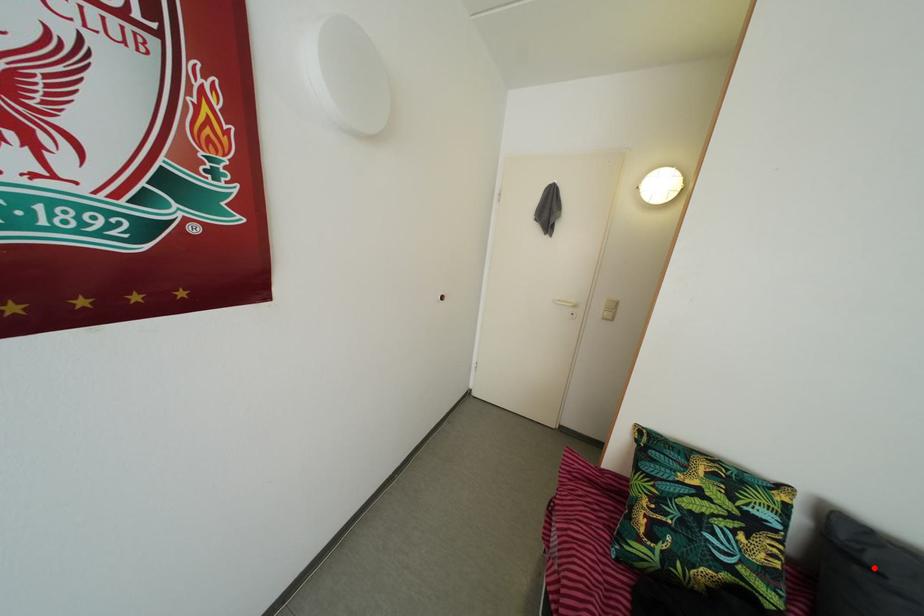
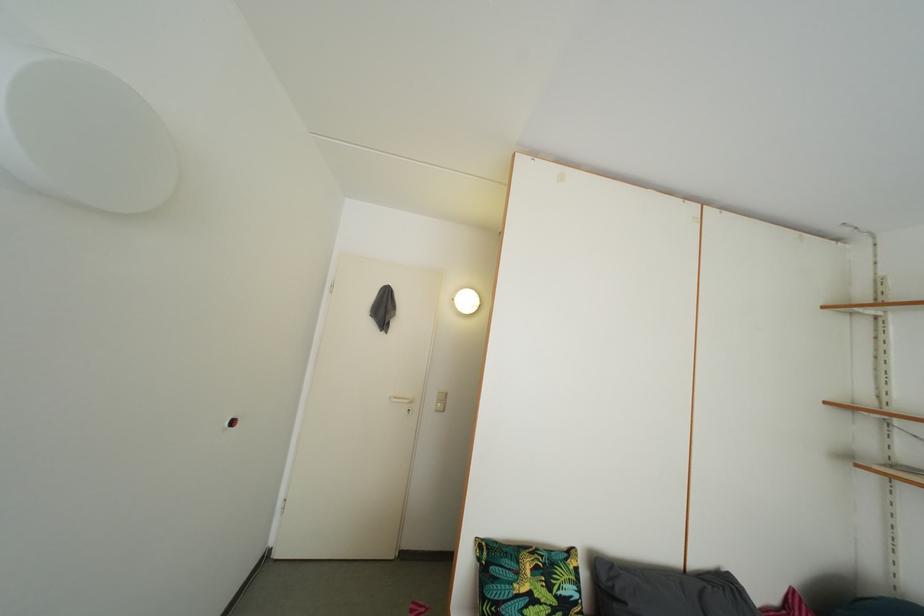
Locate, in the second image, the point that corresponds to the highlighted location in the first image.

(624, 601)